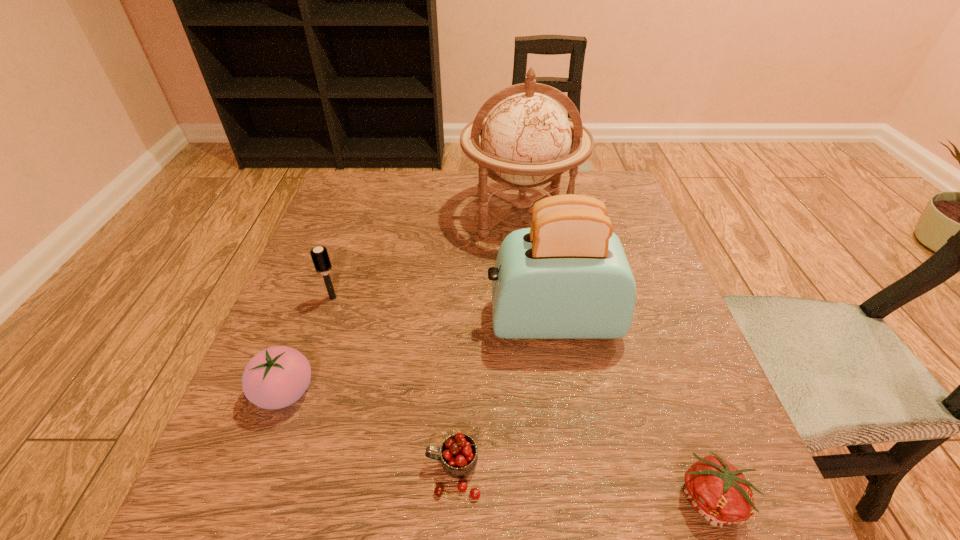
Where is `free space that is in between the left tomato and the right tomato`? This screenshot has width=960, height=540. free space that is in between the left tomato and the right tomato is located at coordinates (499, 446).

This screenshot has height=540, width=960. I want to click on vacant space that's between the fourth farthest object and the cherry, so click(370, 432).

I want to click on object that is the fifth closest to the farther tomato, so click(718, 491).

You are a GUI agent. You are given a task and a screenshot of the screen. Output one action in this format:
    pyautogui.click(x=<x>, y=<y>)
    Task: Click on the object that ranks as the closest to the cherry
    
    Given the screenshot: What is the action you would take?
    pyautogui.click(x=567, y=277)

Locate an element on the screen. This screenshot has height=540, width=960. vacant space that satisfies the following two spatial constraints: 1. at the front of the nearer tomato showing Africa; 2. on the left side of the farthest object is located at coordinates (554, 499).

Locate an element on the screen. This screenshot has height=540, width=960. free spot that satisfies the following two spatial constraints: 1. on the side of the shorter tomato with the lever; 2. on the right side of the toaster is located at coordinates (582, 499).